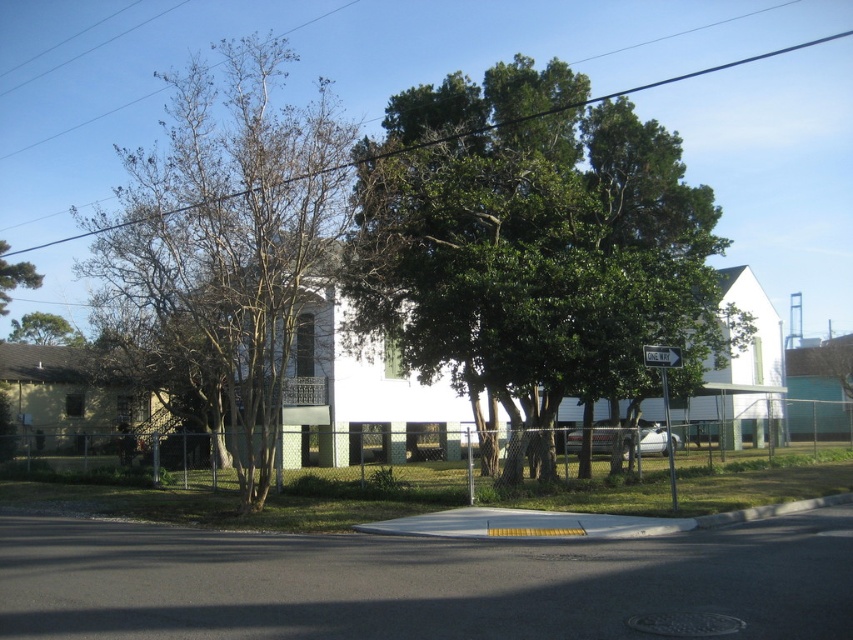
Can you confirm if bare wood tree at left is positioned above green leafy tree at upper left?

Yes.

Can you confirm if bare wood tree at left is wider than green leafy tree at upper left?

Indeed, bare wood tree at left has a greater width compared to green leafy tree at upper left.

Does point (318, 106) come farther from viewer compared to point (22, 269)?

Yes.

Where is `bare wood tree at left`? This screenshot has width=853, height=640. bare wood tree at left is located at coordinates (233, 236).

Is bare wood tree at left further to camera compared to green leafy tree at lower left?

No.

Can you confirm if bare wood tree at left is wider than green leafy tree at lower left?

Yes.

Between point (254, 400) and point (62, 337), which one is positioned behind?

The point (62, 337) is more distant.

I want to click on bare wood tree at left, so click(233, 236).

Does green leafy tree at lower left appear under green leafy tree at upper left?

Correct, green leafy tree at lower left is located below green leafy tree at upper left.

Can you confirm if green leafy tree at lower left is shorter than green leafy tree at upper left?

Yes.

The width and height of the screenshot is (853, 640). What do you see at coordinates (44, 330) in the screenshot?
I see `green leafy tree at lower left` at bounding box center [44, 330].

You are a GUI agent. You are given a task and a screenshot of the screen. Output one action in this format:
    pyautogui.click(x=<x>, y=<y>)
    Task: Click on the green leafy tree at lower left
    
    Given the screenshot: What is the action you would take?
    pyautogui.click(x=44, y=330)